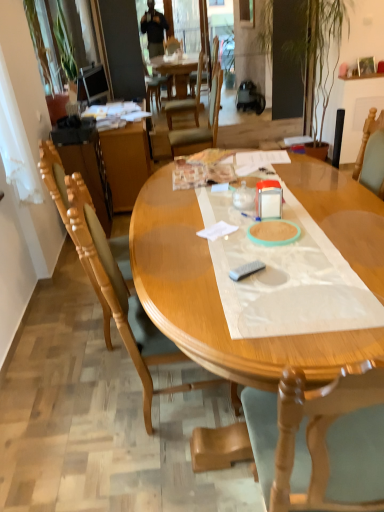
Question: From a real-world perspective, is light brown wood chair at left, the 2th chair in the front-to-back sequence, physically above wooden chair at left, the first chair viewed from the front?

Choices:
 (A) no
 (B) yes

Answer: (A)

Question: From the image's perspective, is light brown wood chair at left, marked as the 2th chair in a back-to-front arrangement, below wooden chair at left, which is counted as the third chair, starting from the back?

Choices:
 (A) yes
 (B) no

Answer: (B)

Question: Would you say light brown wood chair at left, the 2th chair in the front-to-back sequence, is outside wooden chair at left, the first chair viewed from the front?

Choices:
 (A) yes
 (B) no

Answer: (A)

Question: Is light brown wood chair at left, marked as the 2th chair in a back-to-front arrangement, thinner than wooden chair at left, which is counted as the third chair, starting from the back?

Choices:
 (A) no
 (B) yes

Answer: (A)

Question: Considering the relative sizes of light brown wood chair at left, marked as the 2th chair in a back-to-front arrangement, and wooden chair at left, the first chair viewed from the front, in the image provided, is light brown wood chair at left, marked as the 2th chair in a back-to-front arrangement, bigger than wooden chair at left, the first chair viewed from the front,?

Choices:
 (A) no
 (B) yes

Answer: (B)

Question: Can wooden chair at left, which is counted as the third chair, starting from the back, be found inside light brown wood chair at left, marked as the 2th chair in a back-to-front arrangement?

Choices:
 (A) no
 (B) yes

Answer: (A)

Question: Considering the relative positions of wooden chair at center, which is the 1th chair from back to front, and matte black television at upper left in the image provided, is wooden chair at center, which is the 1th chair from back to front, to the right of matte black television at upper left from the viewer's perspective?

Choices:
 (A) yes
 (B) no

Answer: (A)

Question: Is wooden chair at center, acting as the third chair starting from the front, not inside matte black television at upper left?

Choices:
 (A) no
 (B) yes

Answer: (B)

Question: From a real-world perspective, does wooden chair at center, which is the 1th chair from back to front, sit lower than matte black television at upper left?

Choices:
 (A) no
 (B) yes

Answer: (B)

Question: Does wooden chair at center, which is the 1th chair from back to front, contain matte black television at upper left?

Choices:
 (A) no
 (B) yes

Answer: (A)

Question: Does wooden chair at center, acting as the third chair starting from the front, have a smaller size compared to matte black television at upper left?

Choices:
 (A) no
 (B) yes

Answer: (A)

Question: From the image's perspective, would you say wooden chair at center, which is the 1th chair from back to front, is shown under matte black television at upper left?

Choices:
 (A) yes
 (B) no

Answer: (A)

Question: Is light brown wood chair at left, marked as the 2th chair in a back-to-front arrangement, not close to wooden desk at center?

Choices:
 (A) no
 (B) yes

Answer: (B)